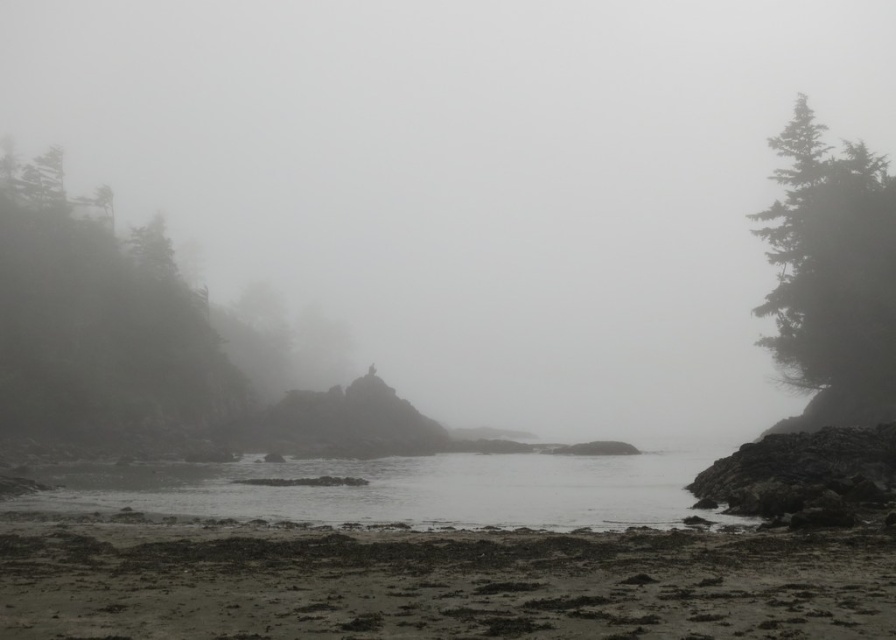
You are an observer standing on the beach in the image. You see the foggy mist at center and the green matte tree at right. Which object is higher in the scene?

The foggy mist at center is higher than the green matte tree at right because it is positioned above it.

You are standing on the beach and see the foggy mist at center and the green matte tree at right. Which object appears closer to the horizon?

The green matte tree at right appears closer to the horizon because it is shorter than the foggy mist at center, which extends higher into the scene.

You are standing on the beach in the image and want to walk from the gray matte water at center to the green matte tree at right. Which direction should you move?

You should move to the right because the gray matte water at center is to the left of the green matte tree at right.